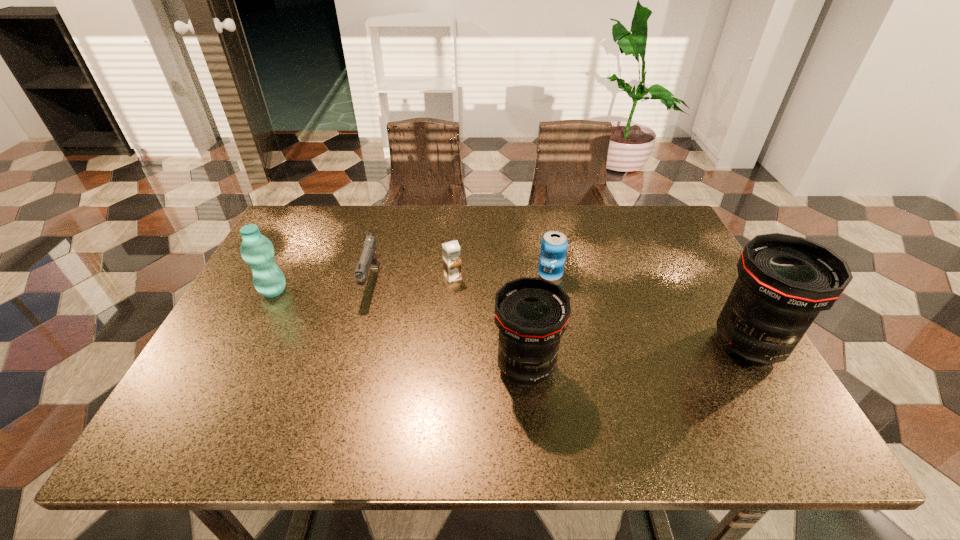
Where is `free space that satisfies the following two spatial constraints: 1. on the back side of the left telephoto lens; 2. on the right side of the soda can`? Image resolution: width=960 pixels, height=540 pixels. free space that satisfies the following two spatial constraints: 1. on the back side of the left telephoto lens; 2. on the right side of the soda can is located at coordinates (516, 274).

Locate an element on the screen. blank space that satisfies the following two spatial constraints: 1. on the front side of the chocolate milk; 2. on the left side of the tallest object is located at coordinates 448,345.

Where is `free point that satisfies the following two spatial constraints: 1. on the back side of the soda can; 2. on the right side of the leftmost object`? This screenshot has width=960, height=540. free point that satisfies the following two spatial constraints: 1. on the back side of the soda can; 2. on the right side of the leftmost object is located at coordinates (282, 274).

Locate an element on the screen. vacant space that satisfies the following two spatial constraints: 1. in the direction the gun is aimed; 2. on the right side of the taller telephoto lens is located at coordinates (353, 345).